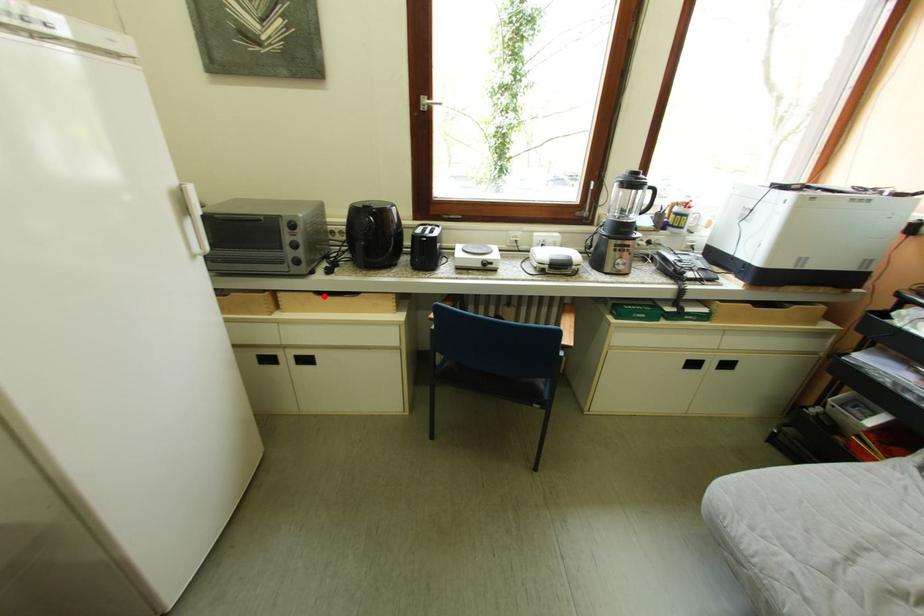
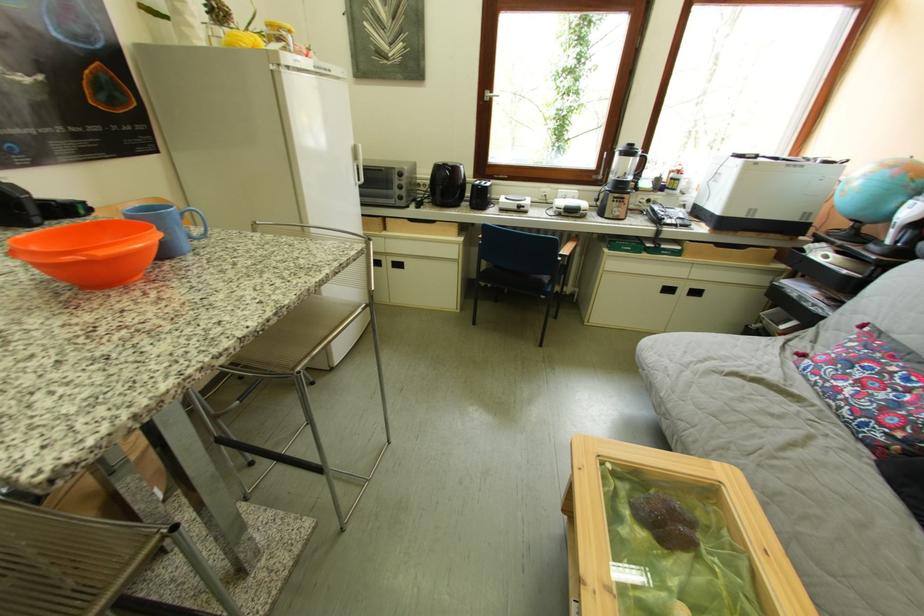
The point at the highlighted location is marked in the first image. Where is the corresponding point in the second image?

(419, 223)